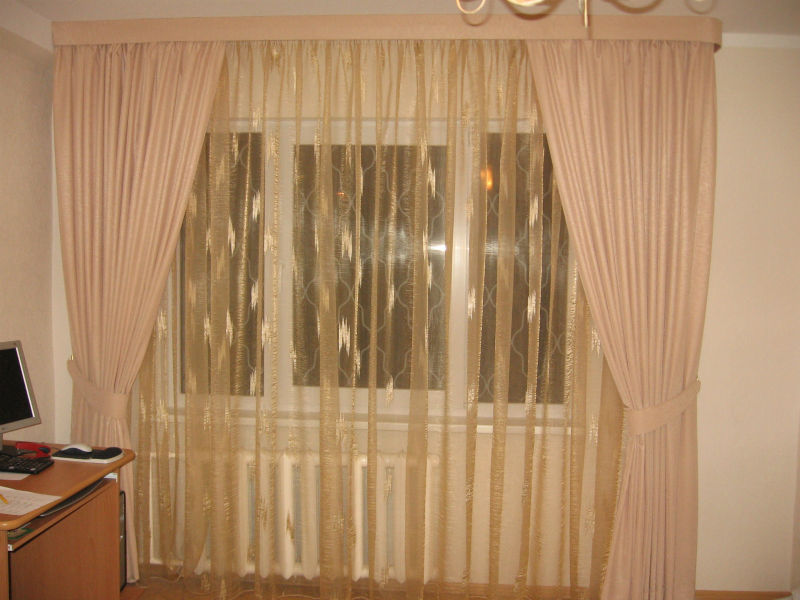
You are a GUI agent. You are given a task and a screenshot of the screen. Output one action in this format:
    pyautogui.click(x=<x>, y=<y>)
    Task: Click on the computer monitor screen
    Image resolution: width=800 pixels, height=600 pixels.
    Given the screenshot: What is the action you would take?
    pyautogui.click(x=14, y=403)